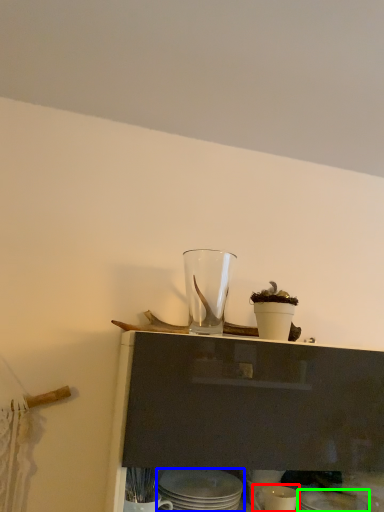
Question: Which object is the farthest from tableware (highlighted by a red box)? Choose among these: tableware (highlighted by a blue box) or tableware (highlighted by a green box).

Choices:
 (A) tableware
 (B) tableware

Answer: (A)